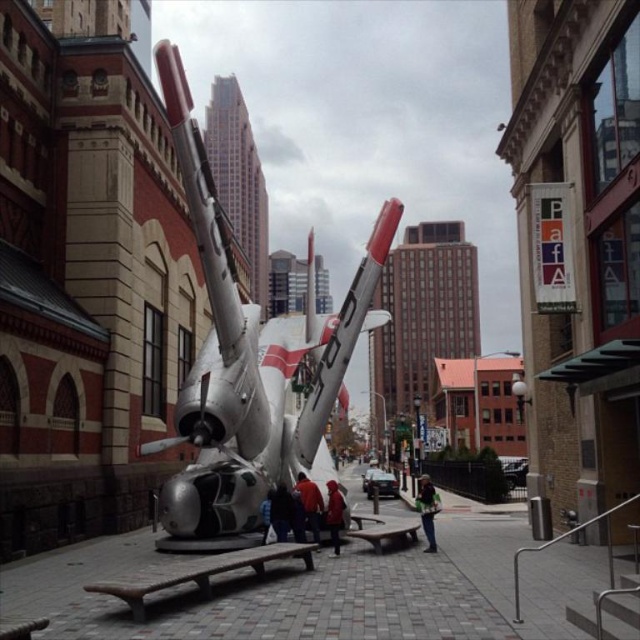
Question: Estimate the real-world distances between objects in this image. Which object is closer to the dark blue jeans at center?

Choices:
 (A) red fabric jacket at center
 (B) green fabric jacket at center

Answer: (A)

Question: Which object is the closest to the dark blue jeans at center?

Choices:
 (A) red jacket at center
 (B) red fabric jacket at center
 (C) blue denim jacket at center

Answer: (C)

Question: Which of the following is the farthest from the observer?

Choices:
 (A) pyautogui.click(x=273, y=518)
 (B) pyautogui.click(x=340, y=515)
 (C) pyautogui.click(x=428, y=484)
 (D) pyautogui.click(x=316, y=515)

Answer: (C)

Question: Is silver metallic airplane at center thinner than green fabric jacket at center?

Choices:
 (A) yes
 (B) no

Answer: (B)

Question: Does red fabric jacket at center appear on the right side of green fabric jacket at center?

Choices:
 (A) no
 (B) yes

Answer: (A)

Question: Does green fabric jacket at center appear under red jacket at center?

Choices:
 (A) yes
 (B) no

Answer: (A)